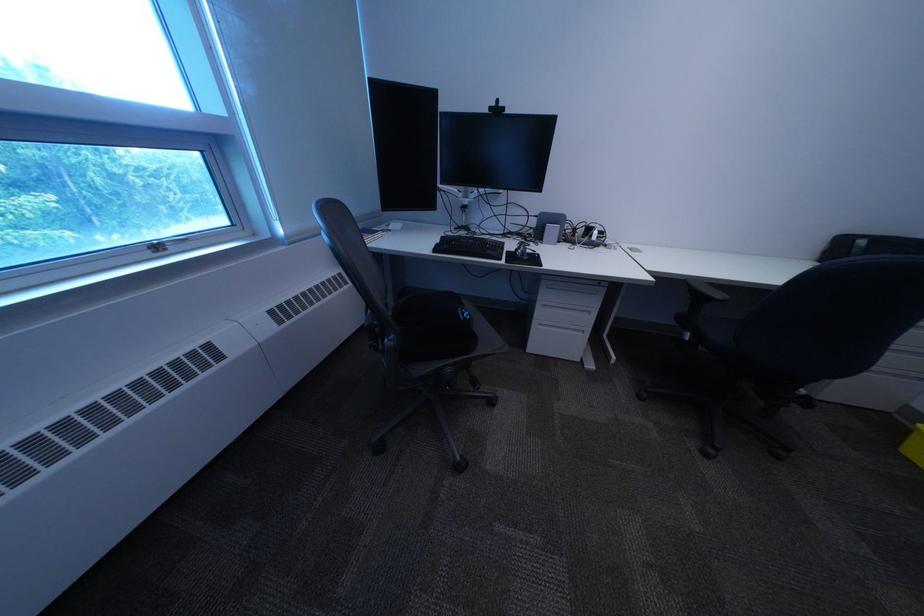
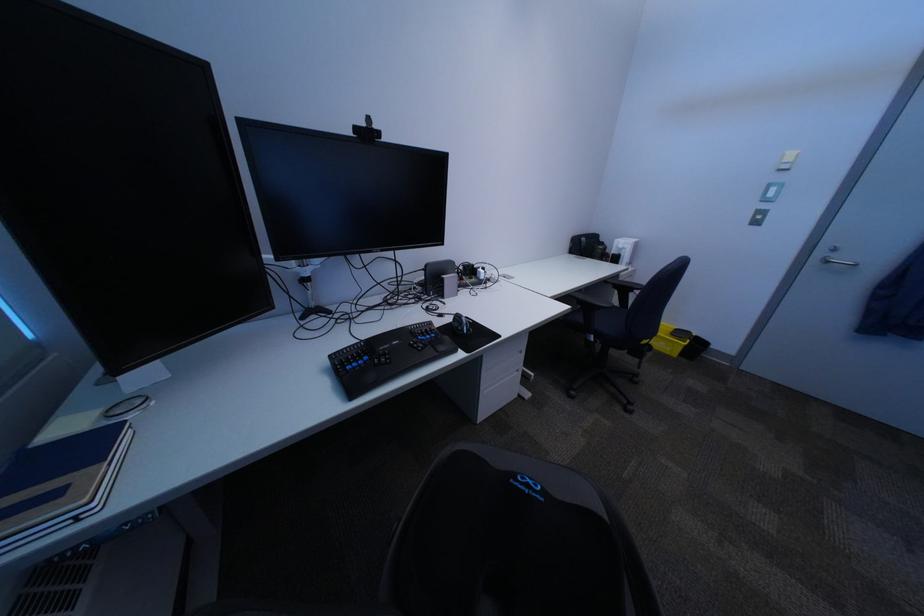
Locate, in the second image, the point that corresponds to point 477,318 in the first image.

(554, 499)